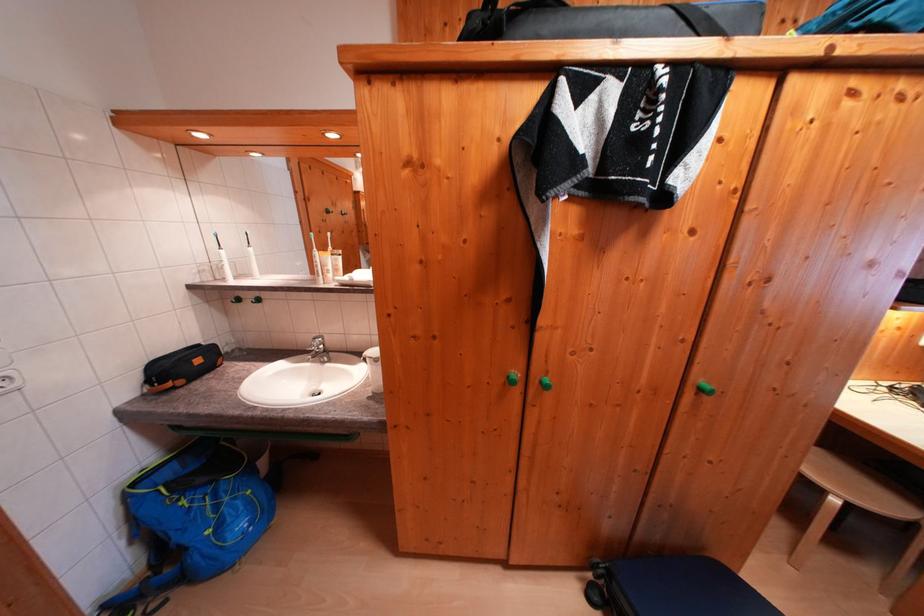
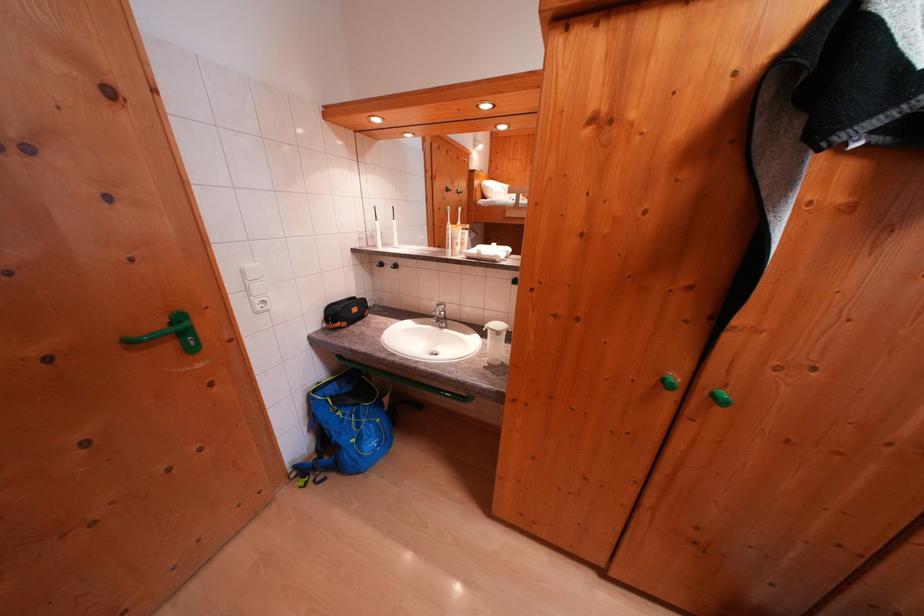
Question: In a continuous first-person perspective shot, in which direction is the camera moving?

Choices:
 (A) Left
 (B) Right
 (C) Forward
 (D) Backward

Answer: (A)